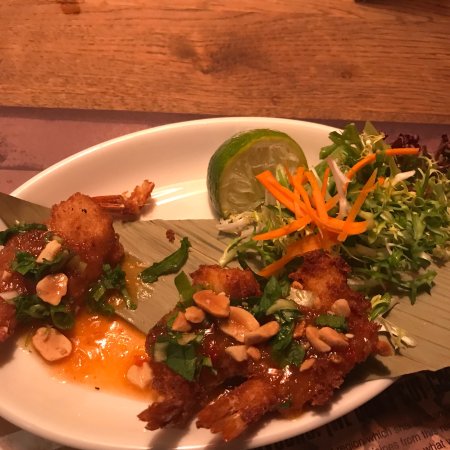
I want to click on plate, so click(169, 161).